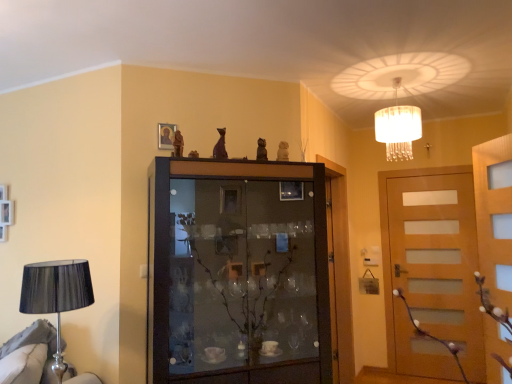
Question: Does point click(390, 134) appear closer or farther from the camera than point click(76, 375)?

Choices:
 (A) closer
 (B) farther

Answer: (B)

Question: Looking at their shapes, would you say translucent glass chandelier at upper center is wider or thinner than metallic lampshade at left?

Choices:
 (A) thin
 (B) wide

Answer: (A)

Question: Which object is the closest to the light brown wood door at right, marked as the 1th door in a right-to-left arrangement?

Choices:
 (A) wooden door at center, the second door viewed from the right
 (B) translucent glass chandelier at upper center
 (C) metallic lampshade at left
 (D) matte gold picture frame at upper center
 (E) brown wooden cupboard at center

Answer: (A)

Question: Considering the real-world distances, which object is farthest from the matte gold picture frame at upper center?

Choices:
 (A) light brown wood door at right, placed as the 2th door when sorted from left to right
 (B) metallic lampshade at left
 (C) brown wooden cupboard at center
 (D) translucent glass chandelier at upper center
 (E) wooden door at center, the second door viewed from the right

Answer: (A)